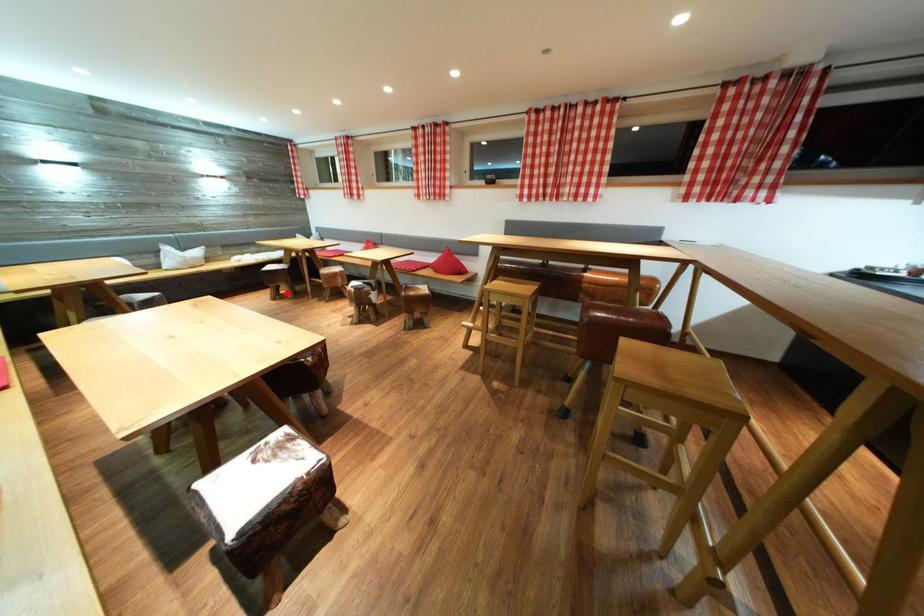
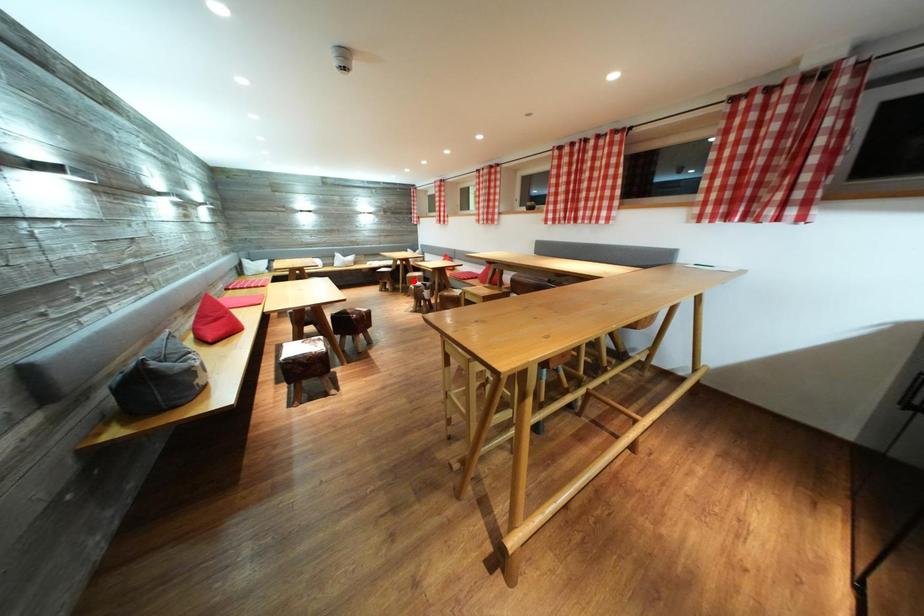
I am providing you with two images of the same scene from different viewpoints. A red point is marked on the first image and another point is marked on the second image. Is the red point in image1 aligned with the point shown in image2?

No